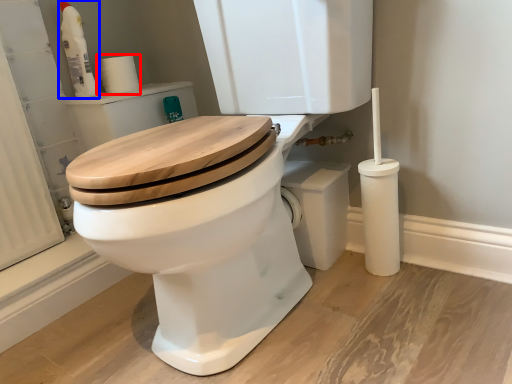
Question: Which object is closer to the camera taking this photo, toilet paper (highlighted by a red box) or cleaning product (highlighted by a blue box)?

Choices:
 (A) toilet paper
 (B) cleaning product

Answer: (B)